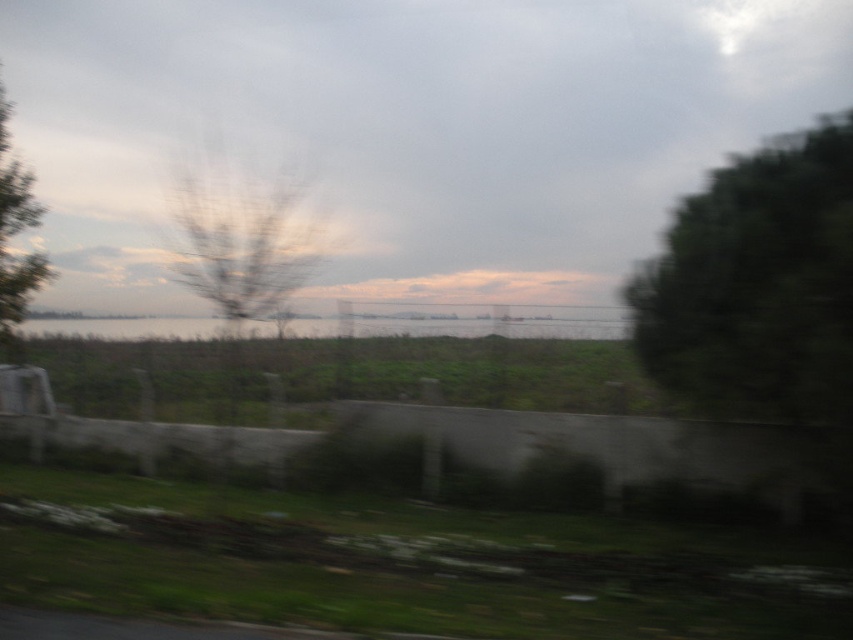
You are standing in the landscape scene and want to move from the point closer to you to the point further away. Which path would you take between the two points, point (735, 353) and point (41, 257)?

You should take the path from point (735, 353) to point (41, 257) because point (735, 353) is closer to the viewer, so moving towards point (41, 257) would be going away from the viewer.

You are standing on the grassy area in front of the concrete wall. You see the green leafy tree at right and the brown leafless branches at center. Which object is positioned farther to the east?

The green leafy tree at right is positioned farther to the east because it is to the right of the brown leafless branches at center, and in the scene, the eastern direction is indicated by the right side of the image.

From the picture: You are standing on the grassy area near the green leafy tree at left and want to reach the clear water at center. Which direction should you walk to get there?

You should walk to the right of the green leafy tree at left to reach the clear water at center because the clear water at center is located to the right of the green leafy tree at left.